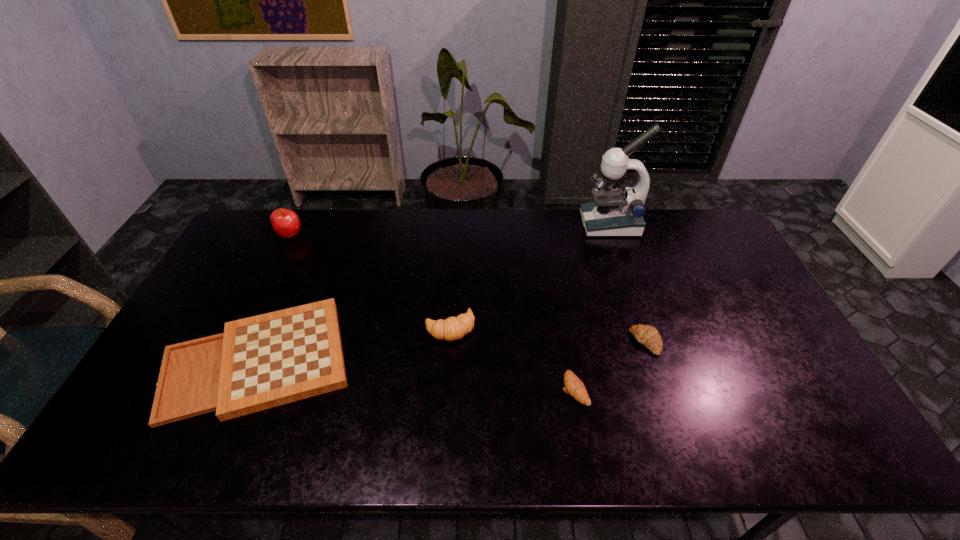
Identify the location of microscope. (613, 213).

This screenshot has width=960, height=540. In order to click on the fifth shortest object in this screenshot , I will do `click(286, 223)`.

The height and width of the screenshot is (540, 960). Find the location of `the tallest crescent roll`. the tallest crescent roll is located at coordinates (453, 328).

Find the location of a particular element. The width and height of the screenshot is (960, 540). the fourth object from right to left is located at coordinates (453, 328).

Locate an element on the screen. This screenshot has height=540, width=960. the rightmost crescent roll is located at coordinates (647, 335).

This screenshot has width=960, height=540. In order to click on the second tallest crescent roll in this screenshot , I will do tap(647, 335).

In order to click on the nearest crescent roll in this screenshot , I will do `click(574, 386)`.

I want to click on the shortest crescent roll, so click(x=574, y=386).

The height and width of the screenshot is (540, 960). I want to click on gameboard, so click(260, 362).

Find the location of a particular element. vacant space situated at the eyepiece of the tallest object is located at coordinates (523, 224).